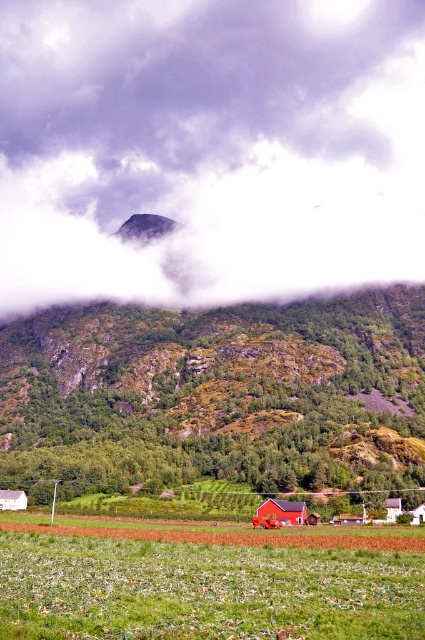
You are a farmer planning to plant crops in the green grass at lower center and the matte red barn at center. Which area has a larger width for planting?

The green grass at lower center has a larger width than the matte red barn at center, so it can accommodate more planting space.

You are a photographer planning to capture the matte red barn at center and the white fluffy cloud at upper center in the same frame. Based on their sizes in the image, which object would appear larger in your photo?

The white fluffy cloud at upper center would appear larger in the photo since it is bigger than the matte red barn at center according to the description.

You are a bird soaring in the sky and want to land on the green grass at lower center. Can you pass through the white fluffy cloud at upper center first?

The white fluffy cloud at upper center is above the green grass at lower center, so yes, you can pass through the white fluffy cloud at upper center before landing on the green grass at lower center.